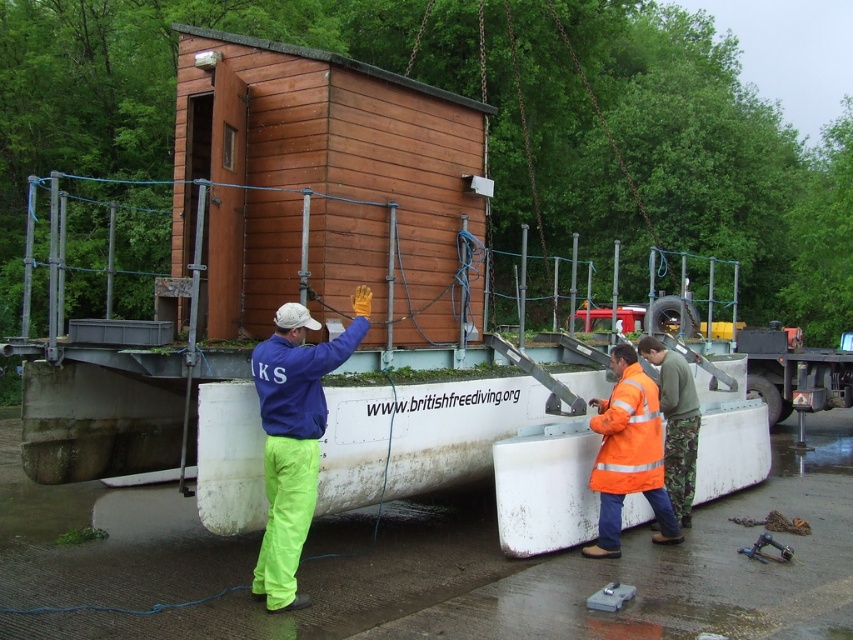
Can you confirm if neon green pants at center is positioned below orange reflective jacket at lower right?

No.

Who is more distant from viewer, (282, 529) or (634, 392)?

The point (634, 392) is behind.

Locate an element on the screen. The height and width of the screenshot is (640, 853). neon green pants at center is located at coordinates (294, 436).

What do you see at coordinates (628, 454) in the screenshot? This screenshot has width=853, height=640. I see `orange reflective jacket at lower right` at bounding box center [628, 454].

Does orange reflective jacket at lower right have a lesser width compared to metallic trailer truck at right?

Yes.

What do you see at coordinates (628, 454) in the screenshot? The height and width of the screenshot is (640, 853). I see `orange reflective jacket at lower right` at bounding box center [628, 454].

The width and height of the screenshot is (853, 640). In order to click on orange reflective jacket at lower right in this screenshot , I will do `click(628, 454)`.

Between neon green pants at center and metallic trailer truck at right, which one appears on the right side from the viewer's perspective?

Positioned to the right is metallic trailer truck at right.

Is point (283, 426) positioned in front of point (805, 406)?

That is True.

Does point (277, 611) lie in front of point (787, 346)?

Yes, point (277, 611) is in front of point (787, 346).

The width and height of the screenshot is (853, 640). I want to click on neon green pants at center, so click(294, 436).